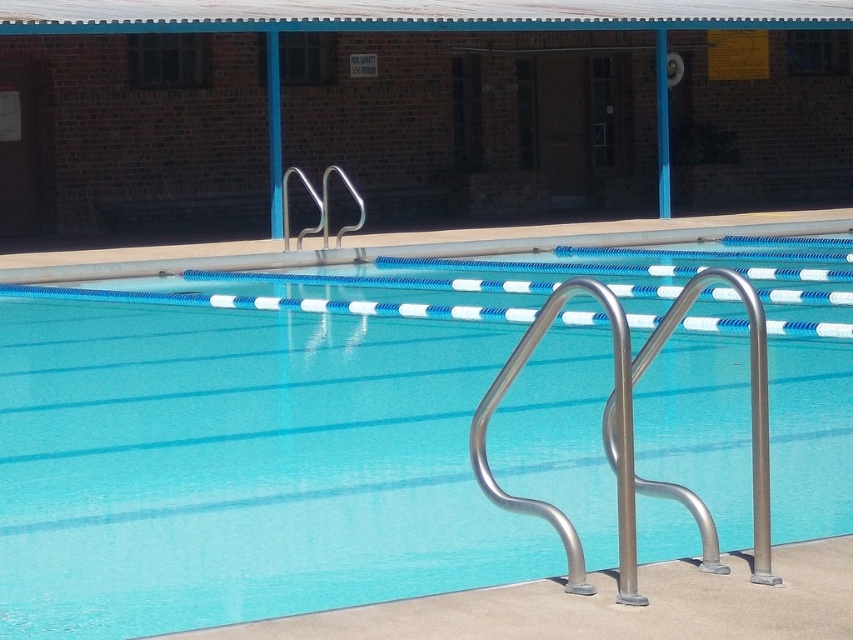
Question: Does clear blue water at center appear over silver metallic handrail at center?

Choices:
 (A) yes
 (B) no

Answer: (A)

Question: Where is silver metallic handrail at center located in relation to silver metallic rail at upper center in the image?

Choices:
 (A) below
 (B) above

Answer: (A)

Question: Estimate the real-world distances between objects in this image. Which object is closer to the concrete at center?

Choices:
 (A) clear blue water at center
 (B) silver metallic handrail at center
 (C) silver metallic rail at upper center

Answer: (B)

Question: Which of these objects is positioned farthest from the silver metallic handrail at center?

Choices:
 (A) concrete at center
 (B) clear blue water at center
 (C) silver metallic rail at upper center

Answer: (C)

Question: Is concrete at center smaller than silver metallic handrail at center?

Choices:
 (A) no
 (B) yes

Answer: (B)

Question: Which point appears farthest from the camera in this image?

Choices:
 (A) (799, 632)
 (B) (711, 524)
 (C) (323, 212)
 (D) (480, 509)

Answer: (C)